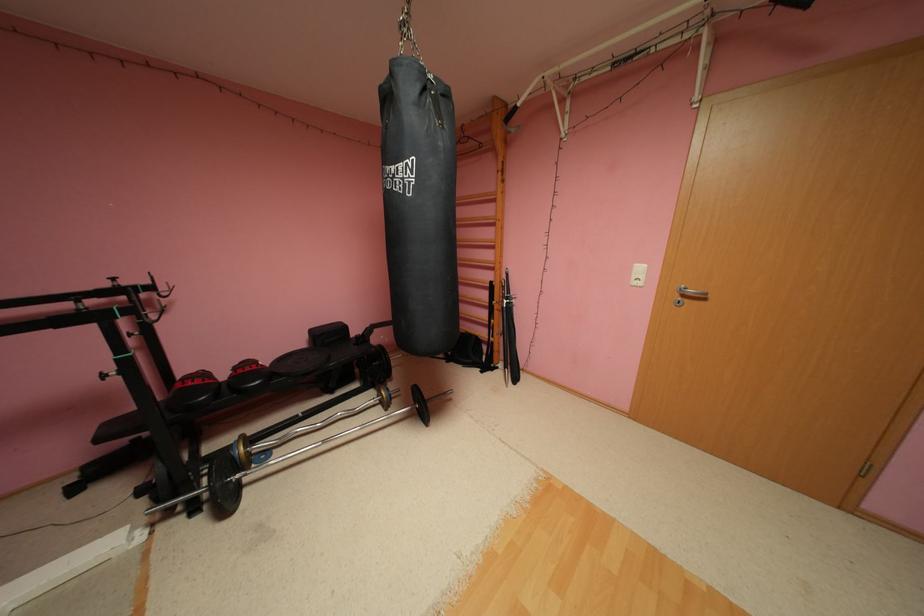
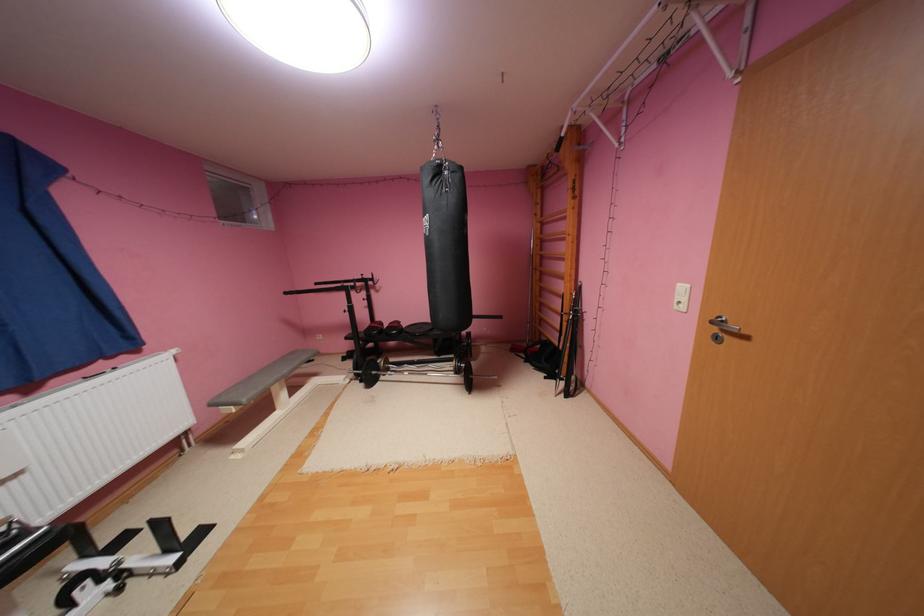
The point at (643, 283) is marked in the first image. Where is the corresponding point in the second image?

(686, 306)